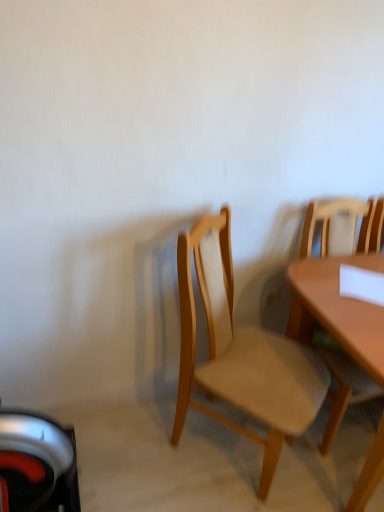
Question: In the image, is light brown wood chair at right, marked as the 1th chair in a right-to-left arrangement, positioned in front of or behind light brown wood chair at center, marked as the 2th chair in a right-to-left arrangement?

Choices:
 (A) front
 (B) behind

Answer: (B)

Question: From a real-world perspective, is light brown wood chair at right, positioned as the 2th chair in left-to-right order, physically located above or below light brown wood chair at center, arranged as the 1th chair when viewed from the left?

Choices:
 (A) below
 (B) above

Answer: (B)

Question: Is light brown wood chair at right, positioned as the 2th chair in left-to-right order, bigger or smaller than light brown wood chair at center, arranged as the 1th chair when viewed from the left?

Choices:
 (A) big
 (B) small

Answer: (B)

Question: Considering their positions, is light brown wood chair at center, marked as the 2th chair in a right-to-left arrangement, located in front of or behind light brown wood chair at right, marked as the 1th chair in a right-to-left arrangement?

Choices:
 (A) behind
 (B) front

Answer: (B)

Question: Based on their positions, is light brown wood chair at center, marked as the 2th chair in a right-to-left arrangement, located to the left or right of light brown wood chair at right, positioned as the 2th chair in left-to-right order?

Choices:
 (A) right
 (B) left

Answer: (B)

Question: Is light brown wood chair at center, arranged as the 1th chair when viewed from the left, inside or outside of light brown wood chair at right, marked as the 1th chair in a right-to-left arrangement?

Choices:
 (A) outside
 (B) inside

Answer: (A)

Question: From a real-world perspective, is light brown wood chair at center, marked as the 2th chair in a right-to-left arrangement, above or below light brown wood chair at right, positioned as the 2th chair in left-to-right order?

Choices:
 (A) above
 (B) below

Answer: (B)